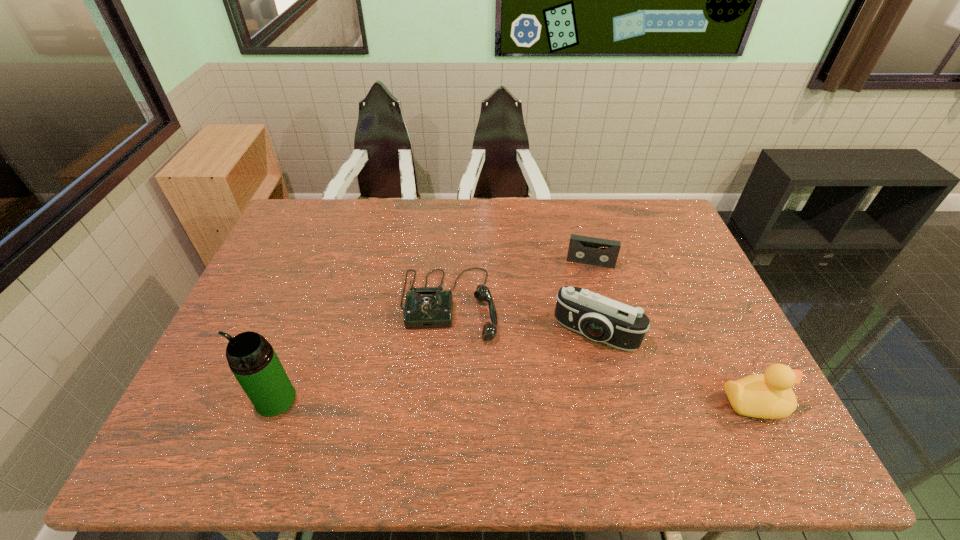
Find the location of a particular element. Image resolution: width=960 pixels, height=540 pixels. the leftmost object is located at coordinates (251, 358).

Locate an element on the screen. This screenshot has height=540, width=960. thermos bottle is located at coordinates (251, 358).

This screenshot has height=540, width=960. In order to click on the rightmost object in this screenshot , I will do `click(769, 395)`.

Find the location of a particular element. The width and height of the screenshot is (960, 540). telephone is located at coordinates (425, 307).

Find the location of `the fourth object from right to left`. the fourth object from right to left is located at coordinates (425, 307).

Find the location of a particular element. the farthest object is located at coordinates (582, 249).

Where is `videotape`? videotape is located at coordinates (582, 249).

At what (x,y) coordinates should I click in order to perform the action: click on camera. Please return your answer as a coordinate pair (x, y). Looking at the image, I should click on [x=601, y=319].

Where is `free space located 0.070m from the spout of the leftmost object`? This screenshot has width=960, height=540. free space located 0.070m from the spout of the leftmost object is located at coordinates (227, 399).

Where is `free point located 0.110m from the spout of the leftmost object`? free point located 0.110m from the spout of the leftmost object is located at coordinates (210, 399).